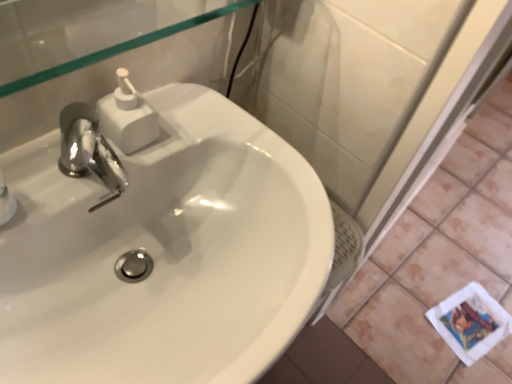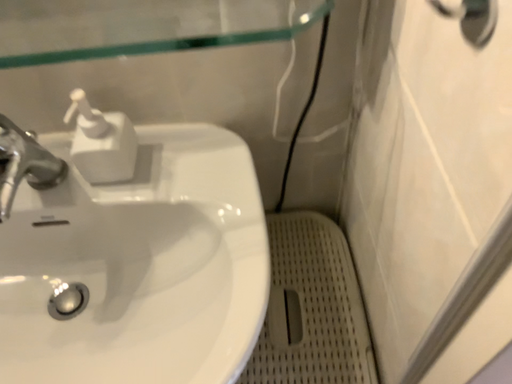
Question: Which way did the camera rotate in the video?

Choices:
 (A) rotated downward
 (B) rotated upward

Answer: (B)